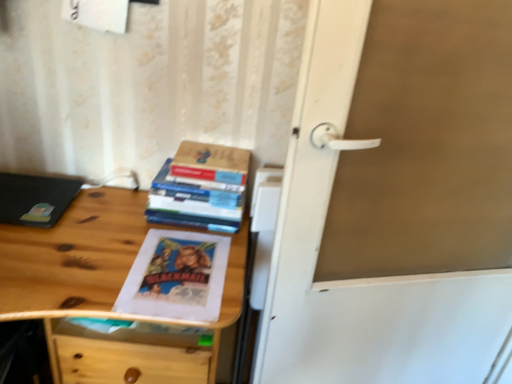
Question: Is hardcover book at upper center at the left side of white matte door handle at center?

Choices:
 (A) no
 (B) yes

Answer: (B)

Question: Can you confirm if hardcover book at upper center is bigger than white matte door handle at center?

Choices:
 (A) yes
 (B) no

Answer: (B)

Question: Is hardcover book at upper center turned away from white matte door handle at center?

Choices:
 (A) yes
 (B) no

Answer: (B)

Question: From the image's perspective, is hardcover book at upper center below white matte door handle at center?

Choices:
 (A) no
 (B) yes

Answer: (A)

Question: Is hardcover book at upper center shorter than white matte door handle at center?

Choices:
 (A) no
 (B) yes

Answer: (B)

Question: Considering the positions of white matte door handle at center and matte black laptop at left in the image, is white matte door handle at center taller or shorter than matte black laptop at left?

Choices:
 (A) tall
 (B) short

Answer: (A)

Question: In the image, is white matte door handle at center positioned in front of or behind matte black laptop at left?

Choices:
 (A) front
 (B) behind

Answer: (A)

Question: From the image's perspective, is white matte door handle at center positioned above or below matte black laptop at left?

Choices:
 (A) above
 (B) below

Answer: (B)

Question: Is white matte door handle at center wider or thinner than matte black laptop at left?

Choices:
 (A) thin
 (B) wide

Answer: (A)

Question: In the image, is white matte door handle at center on the left side or the right side of hardcover books at center?

Choices:
 (A) right
 (B) left

Answer: (A)

Question: Is white matte door handle at center inside or outside of hardcover books at center?

Choices:
 (A) outside
 (B) inside

Answer: (A)

Question: From the image's perspective, is white matte door handle at center located above or below hardcover books at center?

Choices:
 (A) above
 (B) below

Answer: (B)

Question: From a real-world perspective, is white matte door handle at center above or below hardcover books at center?

Choices:
 (A) below
 (B) above

Answer: (A)

Question: Considering the positions of hardcover book at upper center and matte black laptop at left in the image, is hardcover book at upper center taller or shorter than matte black laptop at left?

Choices:
 (A) short
 (B) tall

Answer: (B)

Question: From the image's perspective, is hardcover book at upper center located above or below matte black laptop at left?

Choices:
 (A) below
 (B) above

Answer: (B)